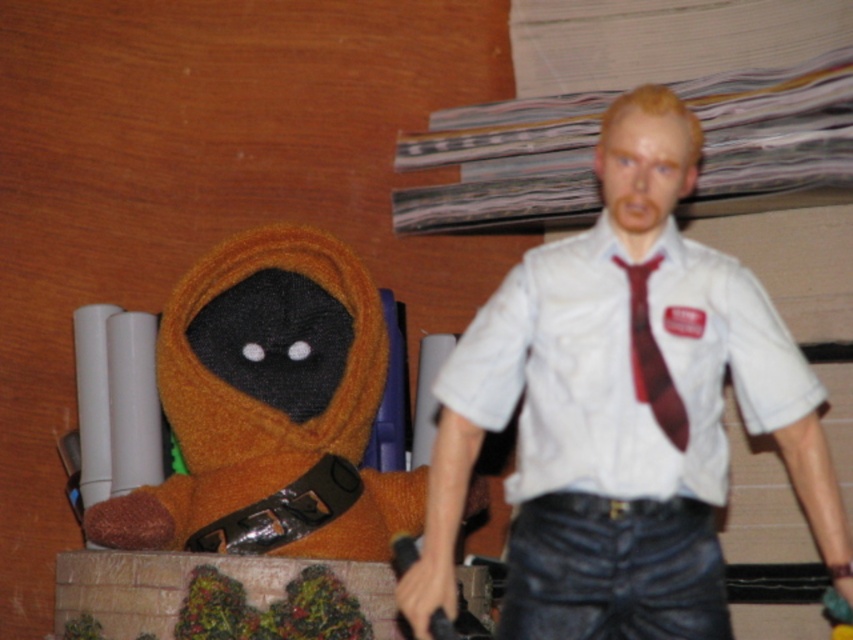
Question: Is white matte shirt at upper right above matte red tie at center?

Choices:
 (A) yes
 (B) no

Answer: (B)

Question: Can you confirm if white matte dress shirt at center is smaller than matte red tie at center?

Choices:
 (A) no
 (B) yes

Answer: (A)

Question: Does white matte shirt at upper right appear under fuzzy orange stuffed toy at left?

Choices:
 (A) no
 (B) yes

Answer: (A)

Question: Which of the following is the closest to the observer?

Choices:
 (A) matte red tie at center
 (B) fuzzy orange stuffed toy at left

Answer: (A)

Question: Based on their relative distances, which object is nearer to the white matte dress shirt at center?

Choices:
 (A) fuzzy orange stuffed toy at left
 (B) white matte shirt at upper right

Answer: (B)

Question: Considering the real-world distances, which object is farthest from the matte red tie at center?

Choices:
 (A) fuzzy orange stuffed toy at left
 (B) white matte dress shirt at center
 (C) white matte shirt at upper right

Answer: (A)